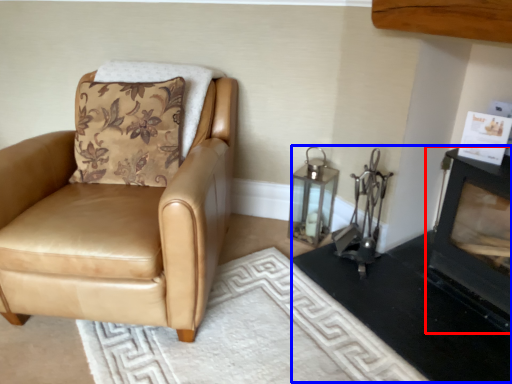
Question: Which point is closer to the camera, fireplace (highlighted by a red box) or fireplace (highlighted by a blue box)?

Choices:
 (A) fireplace
 (B) fireplace

Answer: (A)